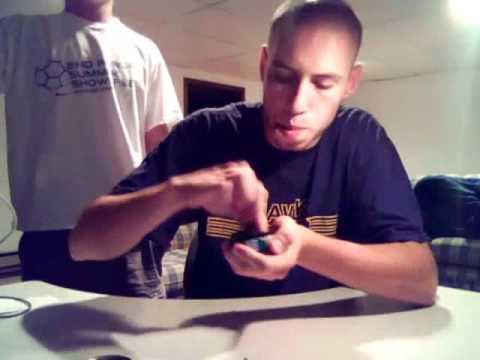
You are a GUI agent. You are given a task and a screenshot of the screen. Output one action in this format:
    pyautogui.click(x=<x>, y=<y>)
    Task: Click on the black doorway
    The image size is (480, 360).
    Given the screenshot: What is the action you would take?
    pyautogui.click(x=202, y=101)